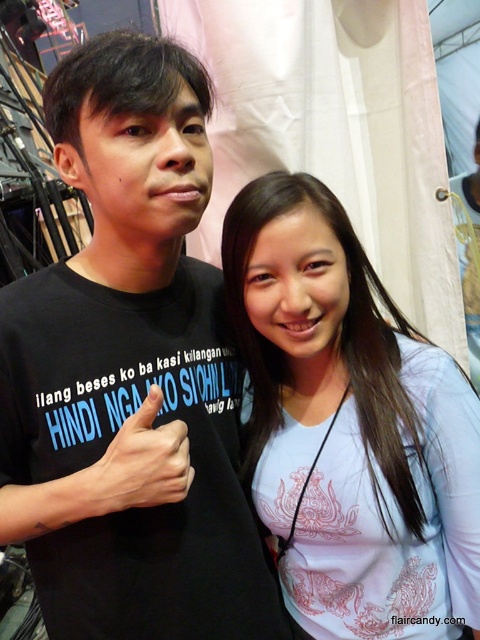
Does black matte t-shirt at center have a greater width compared to white matte shirt at center?

Correct, the width of black matte t-shirt at center exceeds that of white matte shirt at center.

Is black matte t-shirt at center behind white matte shirt at center?

No, it is not.

Who is more distant from viewer, (154, 67) or (389, 445)?

The point (389, 445) is behind.

The height and width of the screenshot is (640, 480). I want to click on black matte t-shirt at center, so click(x=130, y=374).

Which is more to the right, black matte t-shirt at center or black matte hand at center?

black matte t-shirt at center is more to the right.

Which is below, black matte t-shirt at center or black matte hand at center?

Positioned lower is black matte hand at center.

Is point (273, 627) positioned after point (87, 497)?

Yes.

The image size is (480, 640). In order to click on black matte t-shirt at center in this screenshot , I will do `click(130, 374)`.

Find the location of a particular element. This screenshot has width=480, height=640. white matte shirt at center is located at coordinates (336, 408).

Can you confirm if white matte shirt at center is taller than black matte hand at center?

Yes, white matte shirt at center is taller than black matte hand at center.

Is point (300, 570) more distant than point (6, 502)?

Yes, point (300, 570) is farther from viewer.

Where is `white matte shirt at center`? white matte shirt at center is located at coordinates (336, 408).